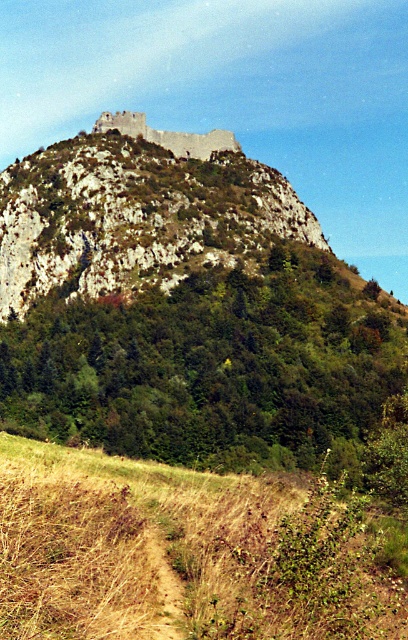
Question: Among these objects, which one is farthest from the camera?

Choices:
 (A) rugged stone mountain at upper center
 (B) brown dirt trail at center
 (C) stone wall at upper center

Answer: (C)

Question: Which of the following is the farthest from the observer?

Choices:
 (A) (6, 268)
 (B) (77, 600)
 (C) (155, 531)

Answer: (A)

Question: Is brown dry grass at lower left below brown dirt trail at center?

Choices:
 (A) no
 (B) yes

Answer: (A)

Question: Considering the real-world distances, which object is farthest from the brown dry grass at lower left?

Choices:
 (A) stone wall at upper center
 (B) brown dirt trail at center

Answer: (A)

Question: Can you confirm if rugged stone mountain at upper center is positioned above brown dirt trail at center?

Choices:
 (A) no
 (B) yes

Answer: (B)

Question: Can you confirm if brown dry grass at lower left is positioned to the right of rugged stone mountain at upper center?

Choices:
 (A) no
 (B) yes

Answer: (B)